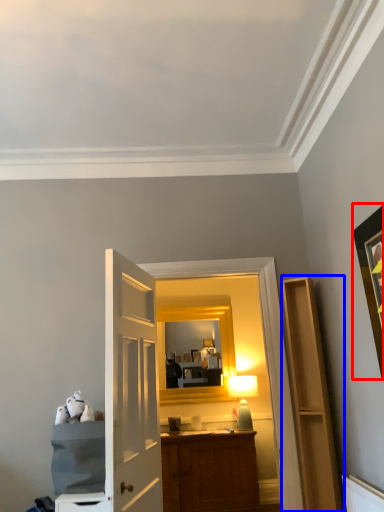
Question: Which of the following is the closest to the observer, picture frame (highlighted by a red box) or cabinetry (highlighted by a blue box)?

Choices:
 (A) picture frame
 (B) cabinetry

Answer: (A)